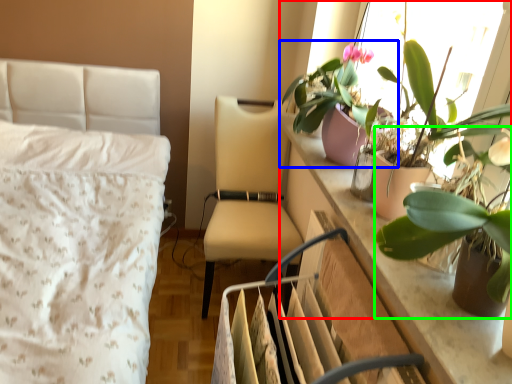
Question: Based on their relative distances, which object is farther from houseplant (highlighted by a red box)? Choose from houseplant (highlighted by a blue box) and houseplant (highlighted by a green box).

Choices:
 (A) houseplant
 (B) houseplant

Answer: (A)